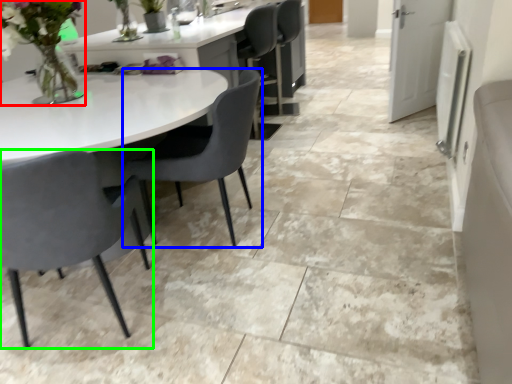
Question: Based on their relative distances, which object is farther from floral arrangement (highlighted by a red box)? Choose from chair (highlighted by a blue box) and chair (highlighted by a green box).

Choices:
 (A) chair
 (B) chair

Answer: (B)